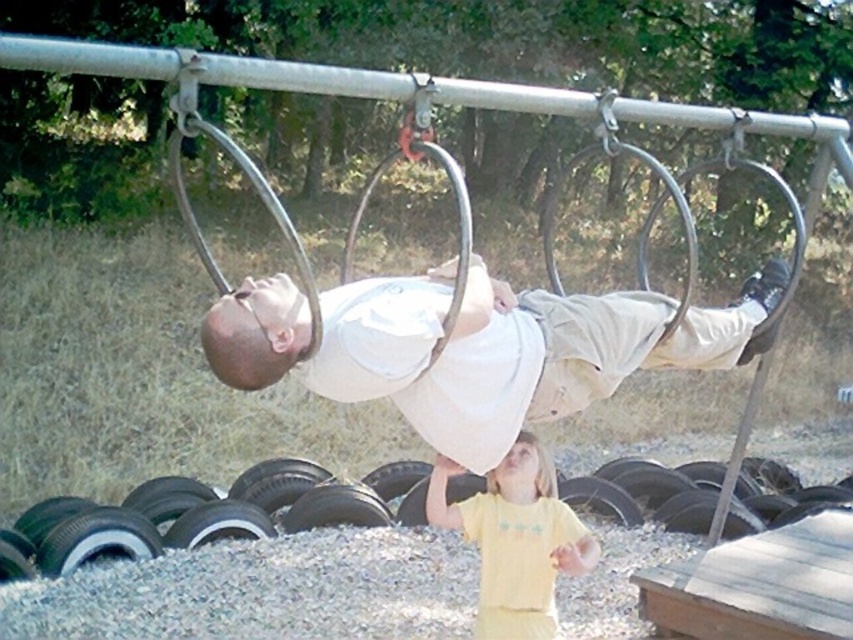
You are a photographer trying to capture a photo of the white cotton shirt at center and the black rubber tire at lower center. Which object should you zoom in on to make them appear the same size in the photo?

The white cotton shirt at center is thinner than the black rubber tire at lower center, so you should zoom in on the white cotton shirt at center to make them appear the same size in the photo.

You are a child at the playground and want to sit on the black rubber tire at lower center. However, there is a yellow cotton shirt at lower center in the way. Can you sit on the tire without moving the shirt?

The black rubber tire at lower center has a larger size compared to yellow cotton shirt at lower center, so you can sit on the tire without moving the shirt because the tire is bigger and there is enough space around the shirt.

You are a photographer trying to capture a photo of both the white cotton shirt at center and the yellow cotton shirt at lower center in the same frame. Based on their positions, which shirt should you focus on first to ensure both are in the frame?

The white cotton shirt at center is to the right of yellow cotton shirt at lower center, so you should focus on the yellow cotton shirt at lower center first to ensure both shirts are included in the frame.